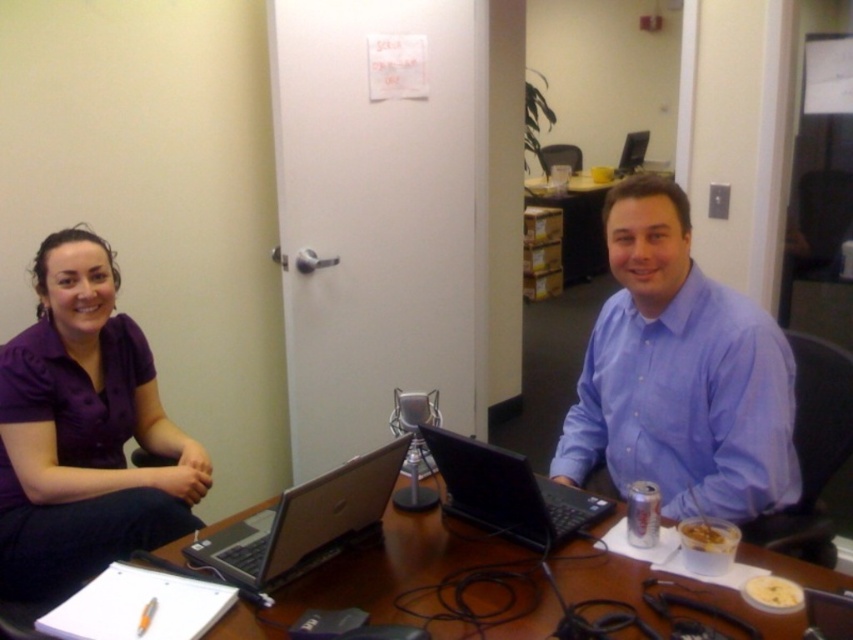
Question: Can you confirm if wooden table at center is wider than silver/black laptop at center?

Choices:
 (A) no
 (B) yes

Answer: (B)

Question: Is blue button-down shirt at center positioned at the back of black matte laptop at center?

Choices:
 (A) yes
 (B) no

Answer: (A)

Question: Which object is positioned farthest from the purple fabric shirt at left?

Choices:
 (A) silver/black laptop at center
 (B) blue button-down shirt at center
 (C) wooden table at center

Answer: (B)

Question: Can you confirm if wooden table at center is wider than silver/black laptop at center?

Choices:
 (A) no
 (B) yes

Answer: (B)

Question: Which object appears closest to the camera in this image?

Choices:
 (A) black matte laptop at center
 (B) wooden table at center
 (C) blue button-down shirt at center

Answer: (B)

Question: Which of these objects is positioned farthest from the purple fabric shirt at left?

Choices:
 (A) black matte laptop at center
 (B) wooden table at center

Answer: (A)